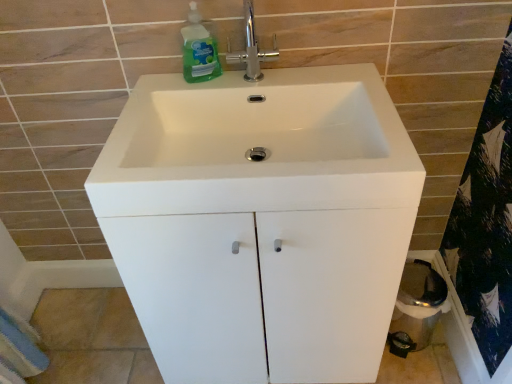
Question: Does green translucent liquid at upper left have a greater height compared to polished chrome faucet at upper center?

Choices:
 (A) no
 (B) yes

Answer: (A)

Question: Is green translucent liquid at upper left not inside polished chrome faucet at upper center?

Choices:
 (A) yes
 (B) no

Answer: (A)

Question: From a real-world perspective, is green translucent liquid at upper left over polished chrome faucet at upper center?

Choices:
 (A) yes
 (B) no

Answer: (B)

Question: Does green translucent liquid at upper left appear on the left side of polished chrome faucet at upper center?

Choices:
 (A) no
 (B) yes

Answer: (B)

Question: Does green translucent liquid at upper left appear on the right side of polished chrome faucet at upper center?

Choices:
 (A) yes
 (B) no

Answer: (B)

Question: Is green translucent liquid at upper left shorter than polished chrome faucet at upper center?

Choices:
 (A) no
 (B) yes

Answer: (B)

Question: Could you tell me if blue textured bath towel at lower left is turned towards white glossy cabinet at center?

Choices:
 (A) no
 (B) yes

Answer: (B)

Question: Is blue textured bath towel at lower left not within white glossy cabinet at center?

Choices:
 (A) yes
 (B) no

Answer: (A)

Question: Is blue textured bath towel at lower left with white glossy cabinet at center?

Choices:
 (A) yes
 (B) no

Answer: (B)

Question: Is blue textured bath towel at lower left positioned with its back to white glossy cabinet at center?

Choices:
 (A) yes
 (B) no

Answer: (B)

Question: Can you confirm if blue textured bath towel at lower left is smaller than white glossy cabinet at center?

Choices:
 (A) no
 (B) yes

Answer: (B)

Question: Are blue textured bath towel at lower left and white glossy cabinet at center far apart?

Choices:
 (A) no
 (B) yes

Answer: (A)

Question: Is green translucent liquid at upper left completely or partially inside white glossy sink at center?

Choices:
 (A) no
 (B) yes

Answer: (A)